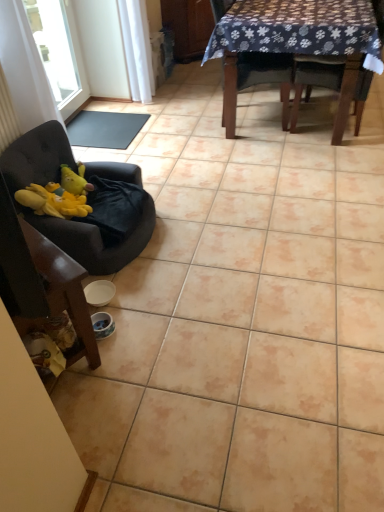
Identify the location of vacant area that is in front of wooden chair at upper right, the second chair from the right. The image size is (384, 512). (287, 148).